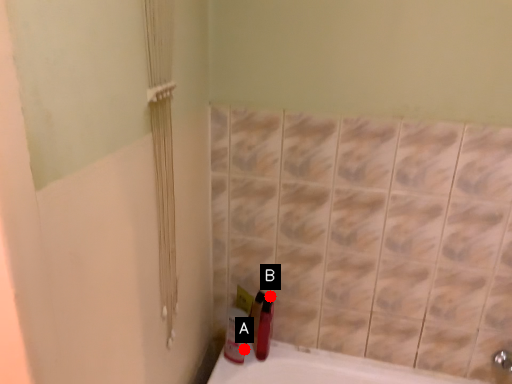
Question: Two points are circled on the image, labeled by A and B beside each circle. Which of the following is the closest to the observer?

Choices:
 (A) A is closer
 (B) B is closer

Answer: (A)